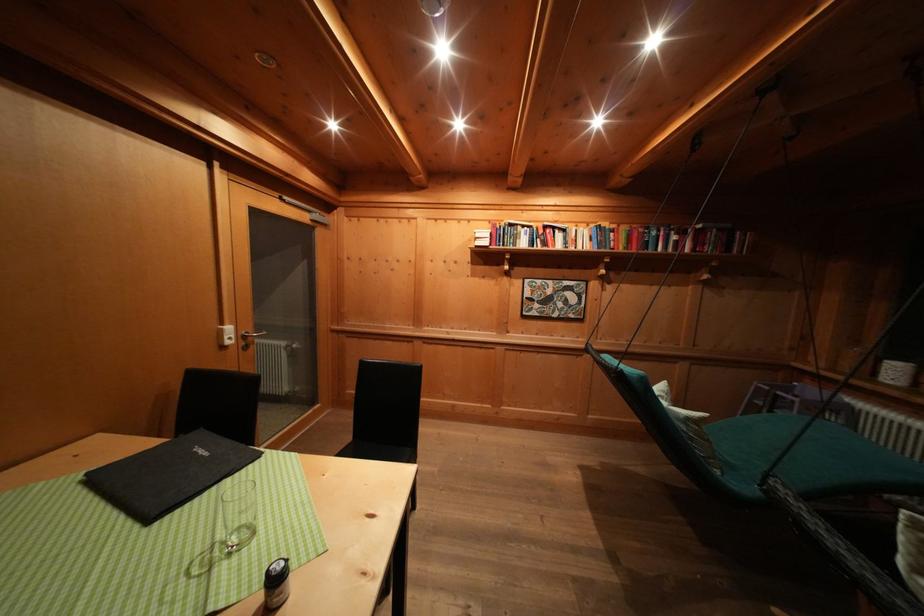
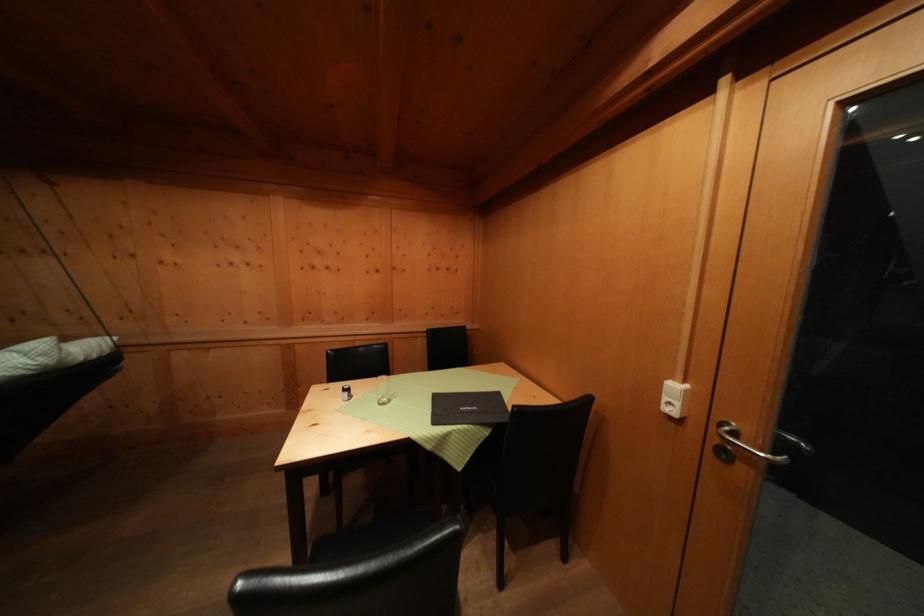
Where in the second image is the point corresponding to pixel 233 342 from the first image?

(672, 403)